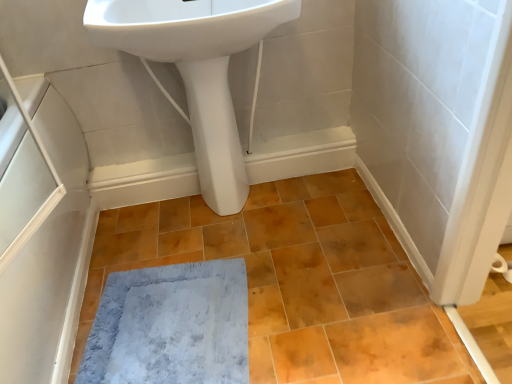
The height and width of the screenshot is (384, 512). I want to click on free spot to the right of white glossy pedestal at center, so click(x=275, y=205).